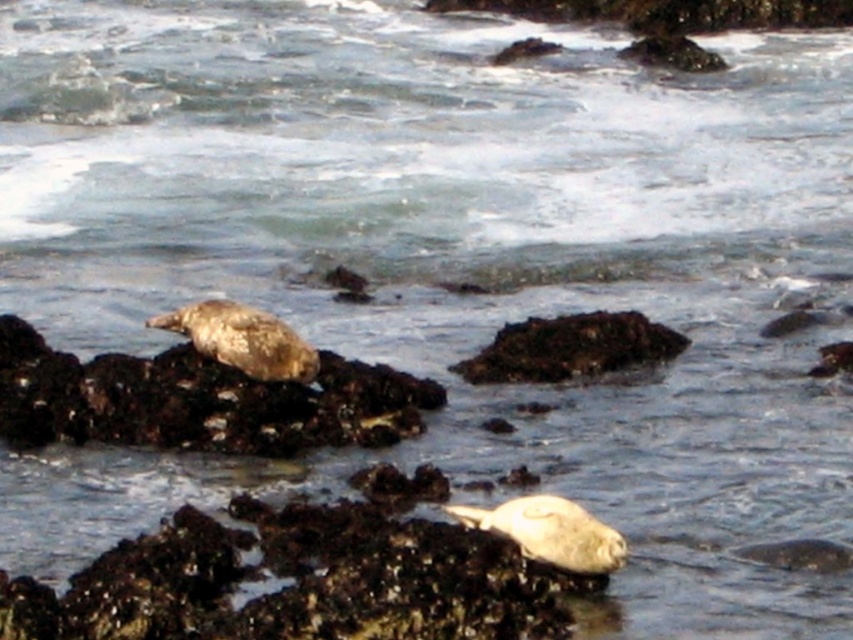
Question: Does grayish-brown fur seal at left have a larger size compared to grayish-brown fur seal at center-left?

Choices:
 (A) no
 (B) yes

Answer: (B)

Question: Is dark brown rock at center bigger than grayish-brown fur seal at center-left?

Choices:
 (A) no
 (B) yes

Answer: (B)

Question: Which of the following is the closest to the observer?

Choices:
 (A) grayish-brown fur seal at center-left
 (B) dark brown rock at center
 (C) grayish-brown fur seal at left

Answer: (A)

Question: Which of these objects is positioned farthest from the grayish-brown fur seal at left?

Choices:
 (A) grayish-brown fur seal at center-left
 (B) dark brown rock at center

Answer: (B)

Question: Considering the real-world distances, which object is farthest from the grayish-brown fur seal at left?

Choices:
 (A) dark brown rock at center
 (B) grayish-brown fur seal at center-left

Answer: (A)

Question: Does dark brown rock at center have a larger size compared to grayish-brown fur seal at center-left?

Choices:
 (A) yes
 (B) no

Answer: (A)